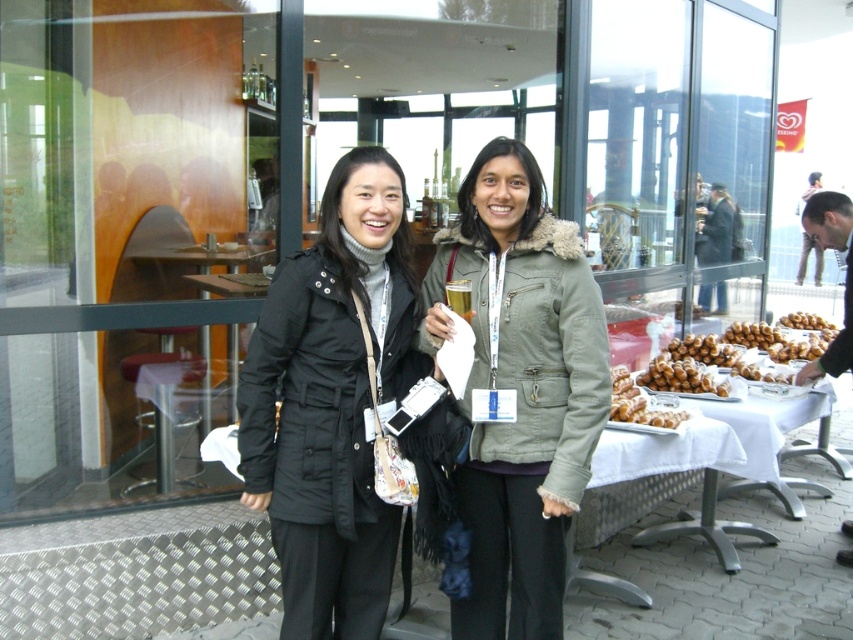
Who is shorter, white tablecloth at lower right or golden brown croissant at right?

With less height is white tablecloth at lower right.

Is white tablecloth at lower right shorter than golden brown croissant at right?

Yes.

Is point (618, 515) behind point (761, 323)?

No, it is not.

Identify the location of white tablecloth at lower right. Image resolution: width=853 pixels, height=640 pixels. (642, 486).

Is olive green jacket at center thinner than white cloth table at right?

Yes.

How much distance is there between olive green jacket at center and white cloth table at right?

olive green jacket at center and white cloth table at right are 1.37 meters apart from each other.

Image resolution: width=853 pixels, height=640 pixels. Describe the element at coordinates (520, 388) in the screenshot. I see `olive green jacket at center` at that location.

Identify the location of olive green jacket at center. The height and width of the screenshot is (640, 853). (520, 388).

Does black matte jacket at center have a larger size compared to olive green jacket at center?

Incorrect, black matte jacket at center is not larger than olive green jacket at center.

Can you confirm if black matte jacket at center is positioned to the right of olive green jacket at center?

Incorrect, black matte jacket at center is not on the right side of olive green jacket at center.

Who is more distant from viewer, (306, 342) or (489, 404)?

Positioned behind is point (489, 404).

At what (x,y) coordinates should I click in order to perform the action: click on black matte jacket at center. Please return your answer as a coordinate pair (x, y). Looking at the image, I should click on (332, 401).